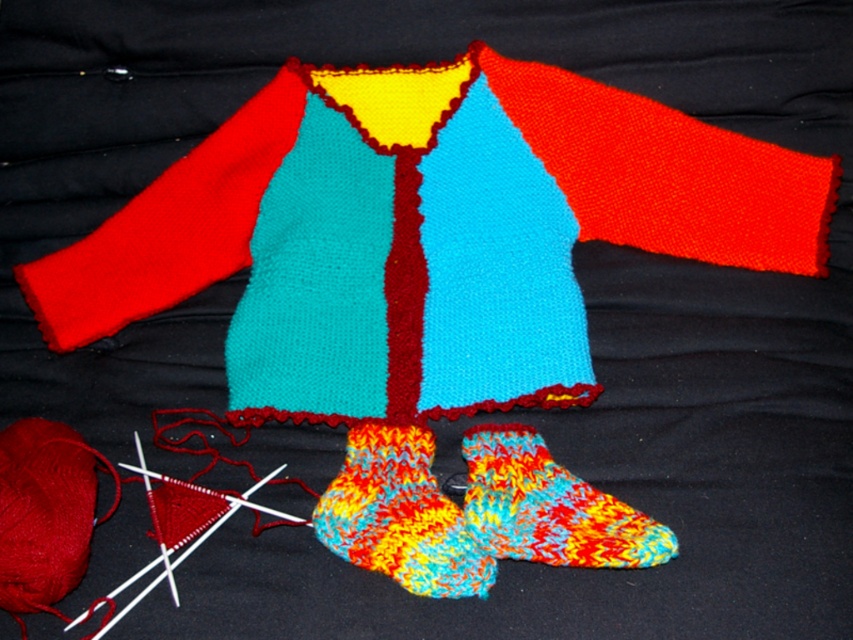
Question: Based on their relative distances, which object is nearer to the multicolored knitted sock at lower center?

Choices:
 (A) multicolored knitted sock at center
 (B) knitted wool sweater at center

Answer: (A)

Question: Among these points, which one is nearest to the camera?

Choices:
 (A) (442, 582)
 (B) (525, 500)

Answer: (A)

Question: Which of these objects is positioned closest to the multicolored knitted sock at lower center?

Choices:
 (A) multicolored knitted sock at center
 (B) knitted wool sweater at center

Answer: (A)

Question: Can you confirm if knitted wool sweater at center is positioned to the right of multicolored knitted sock at center?

Choices:
 (A) no
 (B) yes

Answer: (B)

Question: From the image, what is the correct spatial relationship of knitted wool sweater at center in relation to multicolored knitted sock at lower center?

Choices:
 (A) right
 (B) left

Answer: (B)

Question: Considering the relative positions of multicolored knitted sock at center and multicolored knitted sock at lower center in the image provided, where is multicolored knitted sock at center located with respect to multicolored knitted sock at lower center?

Choices:
 (A) right
 (B) left

Answer: (B)